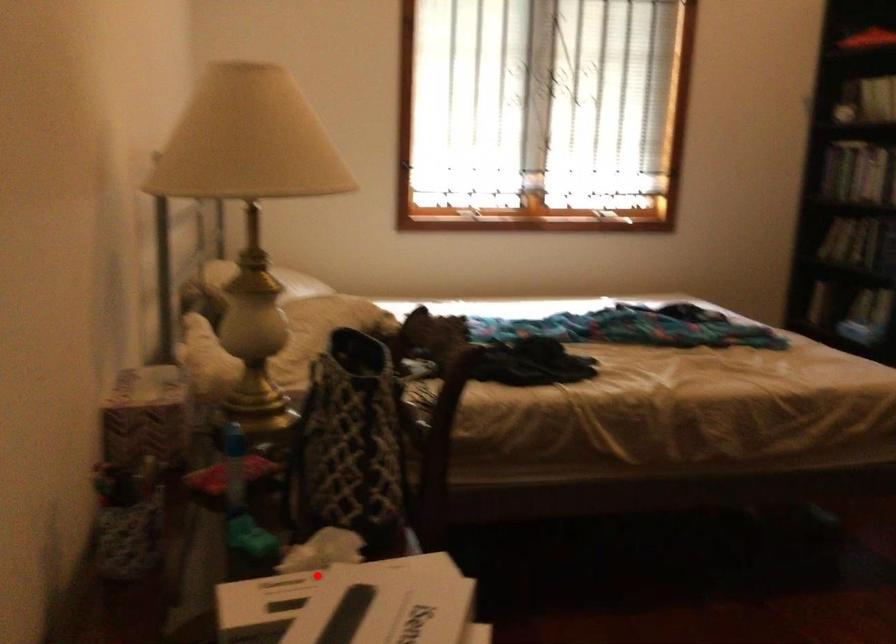
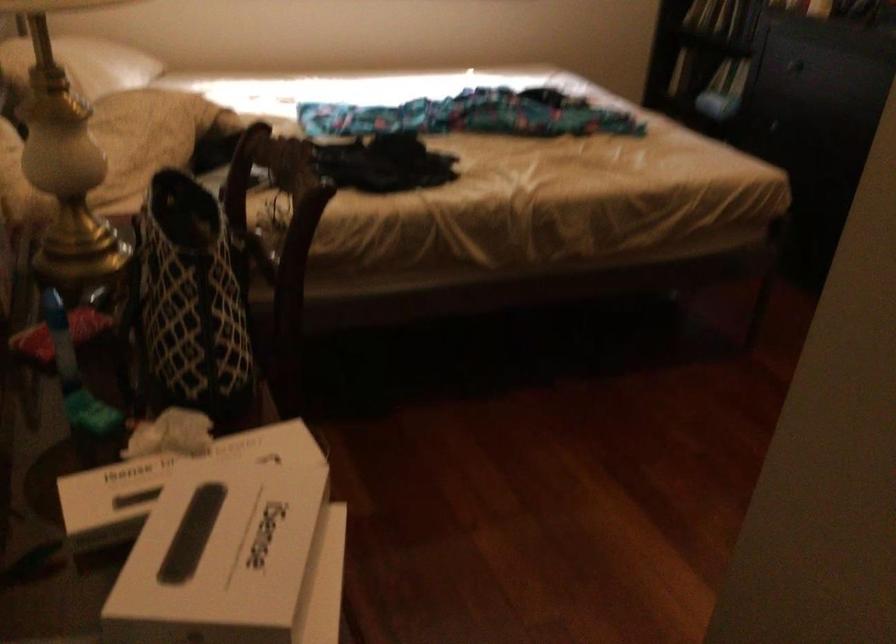
Question: I am providing you with two images of the same scene from different viewpoints. A red point is shown in image1. For the corresponding object point in image2, is it positioned nearer or farther from the camera?

Choices:
 (A) Nearer
 (B) Farther

Answer: (A)